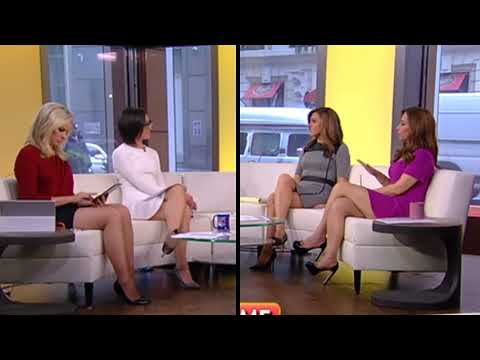
This screenshot has height=360, width=480. In order to click on blue mug in this screenshot , I will do `click(221, 220)`.